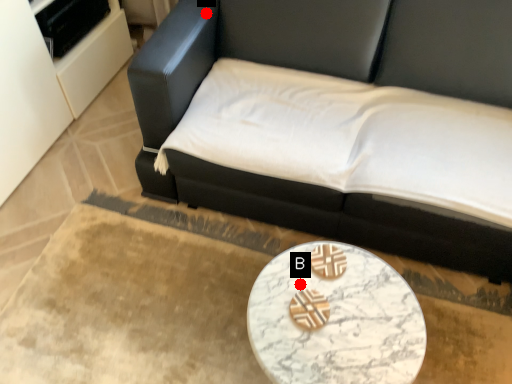
Question: Two points are circled on the image, labeled by A and B beside each circle. Which point appears closest to the camera in this image?

Choices:
 (A) A is closer
 (B) B is closer

Answer: (B)